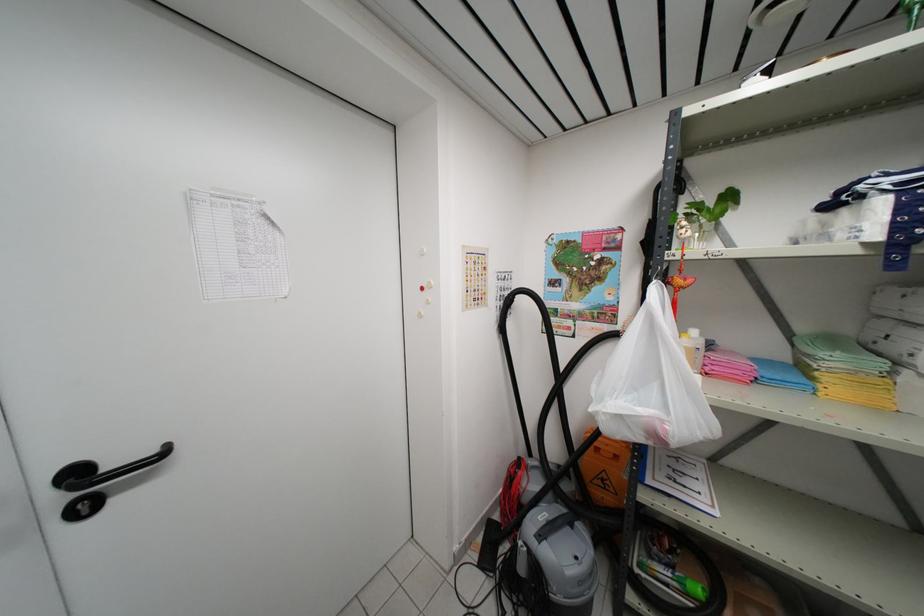
Where is `door keyhole`? door keyhole is located at coordinates (82, 506).